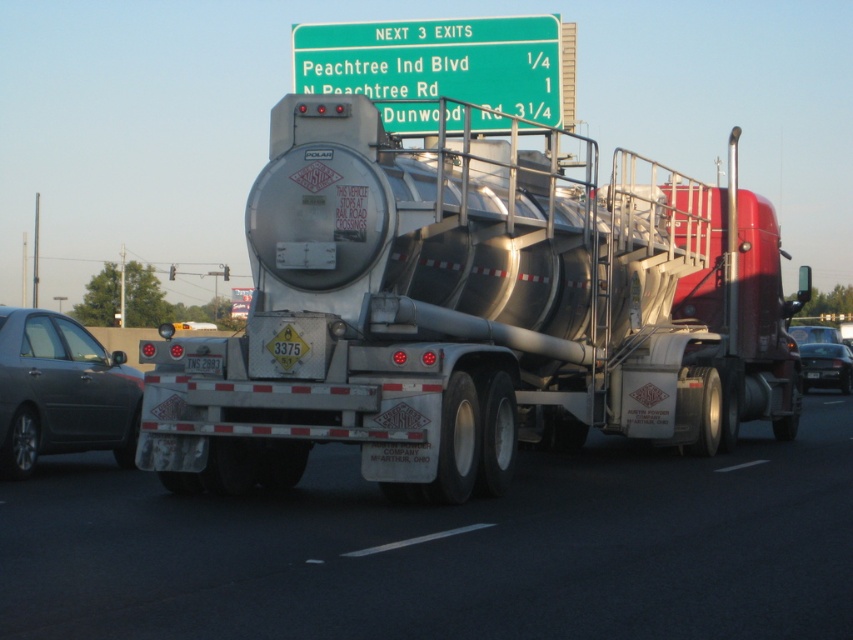
Question: Which of the following is the farthest from the observer?

Choices:
 (A) (32, 440)
 (B) (204, 362)
 (C) (322, 472)
 (D) (300, 36)

Answer: (D)

Question: Considering the real-world distances, which object is farthest from the silver metallic tanker truck at center?

Choices:
 (A) black plastic license plate at rear
 (B) green plastic sign at upper center
 (C) black glossy sedan at lower right

Answer: (A)

Question: Observing the image, what is the correct spatial positioning of silver metallic tanker truck at center in reference to metallic gray sedan at left?

Choices:
 (A) left
 (B) right

Answer: (B)

Question: Is metallic gray sedan at left bigger than black plastic license plate at rear?

Choices:
 (A) no
 (B) yes

Answer: (B)

Question: Is metallic gray sedan at left wider than white plastic license plate at rear?

Choices:
 (A) yes
 (B) no

Answer: (A)

Question: Considering the real-world distances, which object is farthest from the metallic gray sedan at left?

Choices:
 (A) silver metallic tanker truck at center
 (B) brushed metal tanker at center
 (C) green plastic sign at upper center
 (D) black glossy sedan at lower right

Answer: (D)